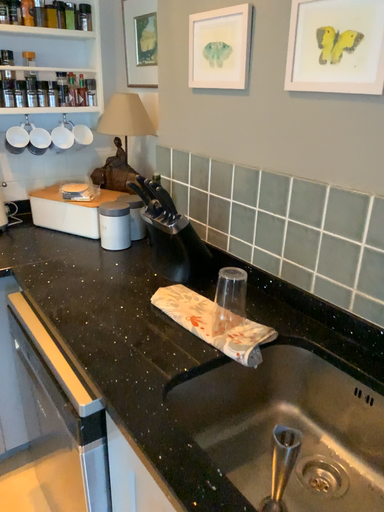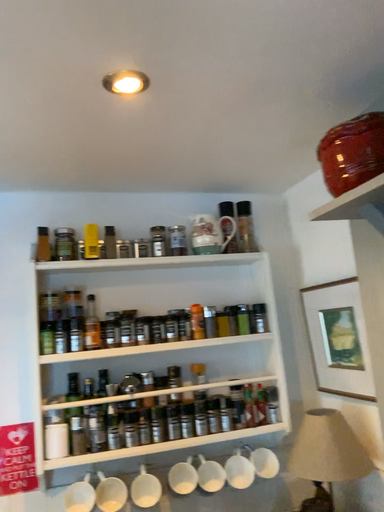
Question: Which way did the camera rotate in the video?

Choices:
 (A) rotated downward
 (B) rotated upward

Answer: (B)